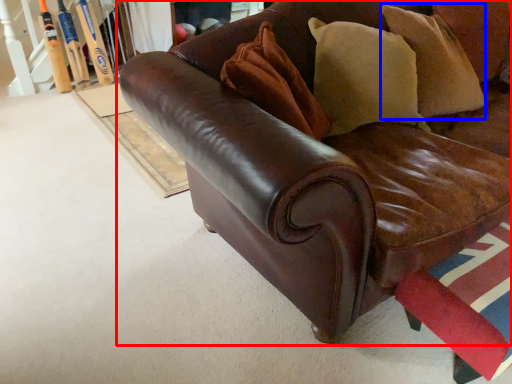
Question: Which object appears farthest to the camera in this image, studio couch (highlighted by a red box) or pillow (highlighted by a blue box)?

Choices:
 (A) studio couch
 (B) pillow

Answer: (B)